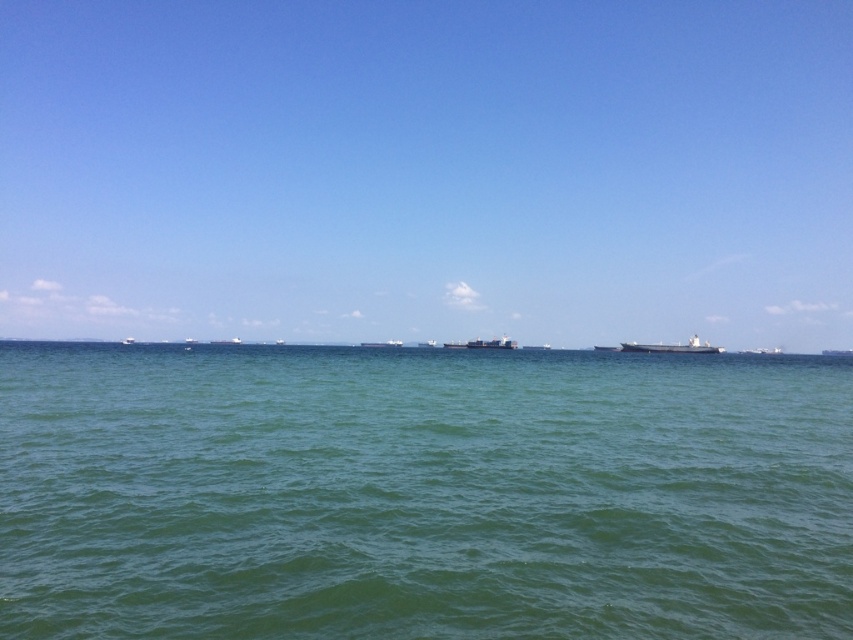
You are a photographer planning to capture the entire scene of the green water at center and the metallic gray ship at center in one shot. Can you fit both objects in the frame without cropping either of them?

The green water at center is bigger than the metallic gray ship at center, so if the photographer wants to include both in the frame without cropping, they might need to adjust their position or use a wider lens to accommodate the larger size of the green water at center.

You are a photographer trying to capture the metallic gray ship at center and the green water at center in a single frame. Based on their positions, which object should you adjust your camera to focus on first if you want to include both in your shot?

The metallic gray ship at center is to the left of the green water at center, so you should focus on the metallic gray ship at center first to ensure both objects are captured in the frame.

You are a marine biologist planning to deploy a research buoy between the metallic gray ship at right and the metallic gray ship at center. The buoy requires a minimum distance of 80 meters between the two ships to be safely anchored. Can the buoy be deployed in this location?

The metallic gray ship at right and metallic gray ship at center are 87.61 meters apart from each other. Since this distance exceeds the minimum requirement of 80 meters, the buoy can be safely deployed between them.